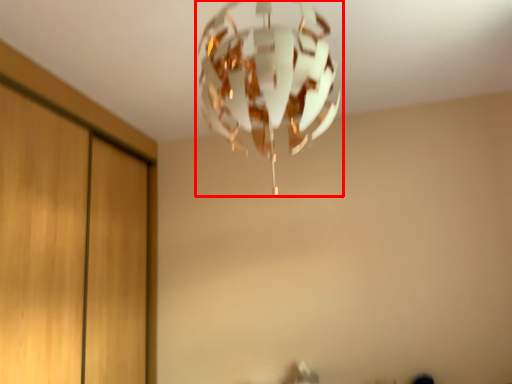
Question: From the image's perspective, where is lamp (annotated by the red box) located relative to dresser?

Choices:
 (A) above
 (B) below

Answer: (A)